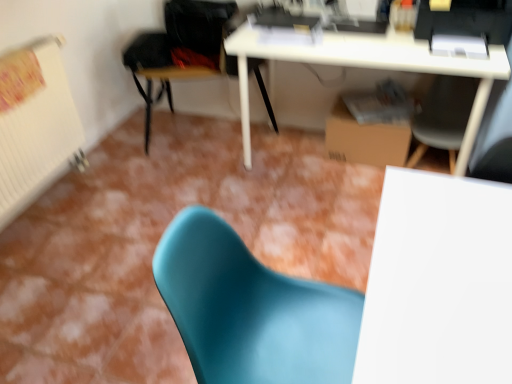
The height and width of the screenshot is (384, 512). I want to click on vacant area that lies between white glossy desk at upper center and black leather chair at center, arranged as the third chair when viewed from the front, so click(x=264, y=175).